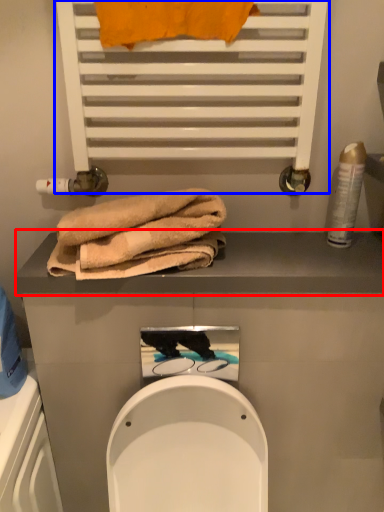
Question: Among these objects, which one is farthest to the camera, balustrade (highlighted by a red box) or shelf (highlighted by a blue box)?

Choices:
 (A) balustrade
 (B) shelf

Answer: (A)